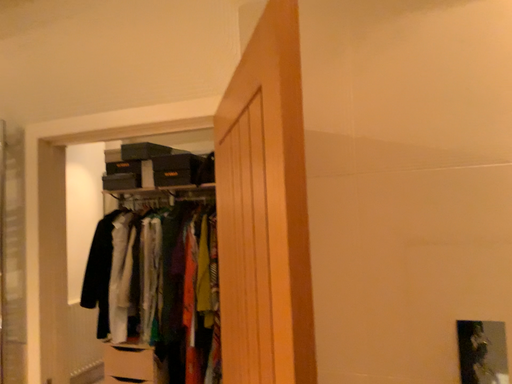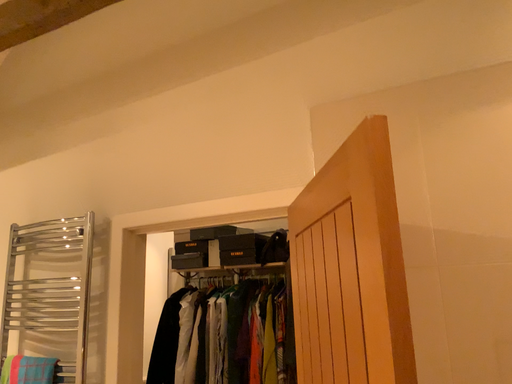
Question: Which way did the camera rotate in the video?

Choices:
 (A) rotated upward
 (B) rotated downward

Answer: (A)